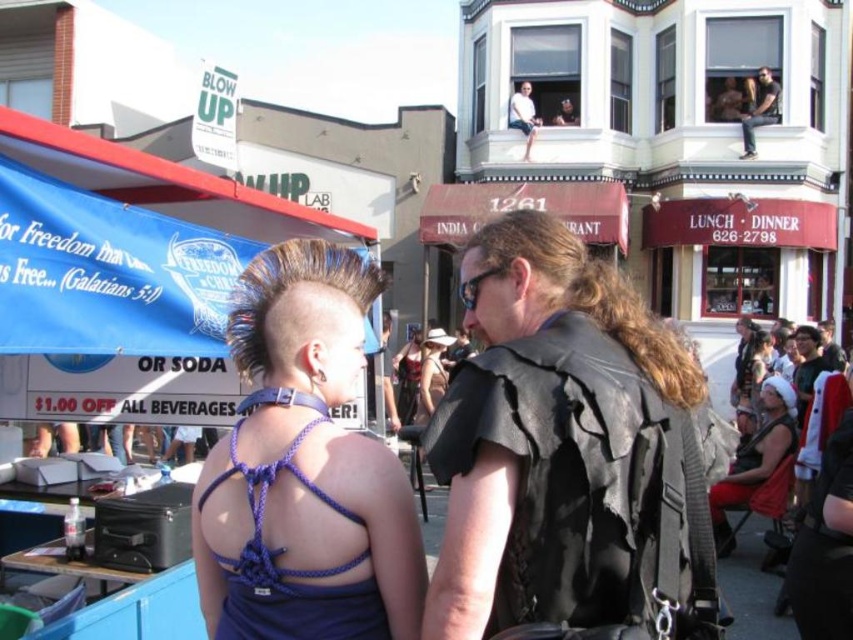
Question: Considering the real-world distances, which object is closest to the matte black vest at center?

Choices:
 (A) velvet red dress at lower right
 (B) blue fabric canopy at left
 (C) light blue denim shorts at upper center

Answer: (C)

Question: Considering the relative positions of leather vest at center and brown matte hair at center in the image provided, where is leather vest at center located with respect to brown matte hair at center?

Choices:
 (A) left
 (B) right

Answer: (A)

Question: Where is blue fabric canopy at left located in relation to blue rope dress at center in the image?

Choices:
 (A) right
 (B) left

Answer: (B)

Question: Is blue fabric canopy at left positioned in front of velvet red dress at lower right?

Choices:
 (A) no
 (B) yes

Answer: (B)

Question: Considering the real-world distances, which object is closest to the dark brown leather hair at center?

Choices:
 (A) matte black backpack at center
 (B) matte black dress at center
 (C) velvet red dress at lower right

Answer: (C)

Question: Which of the following is the farthest from the observer?

Choices:
 (A) (123, 179)
 (B) (801, 369)
 (C) (561, 280)

Answer: (B)